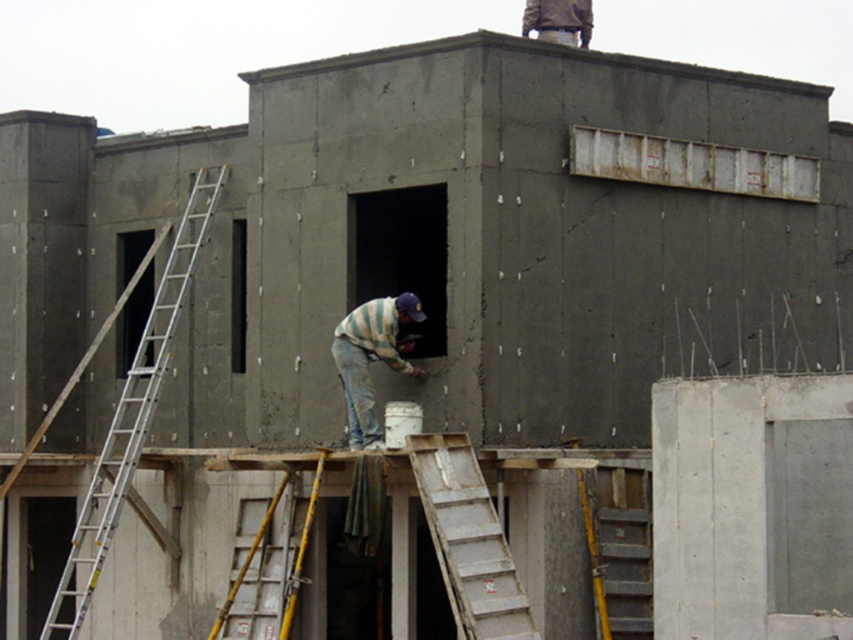
Between point (178, 280) and point (496, 621), which one is positioned behind?

Point (178, 280)

Find the location of `silver metallic ladder at left`. silver metallic ladder at left is located at coordinates (131, 417).

Is point (486, 561) behind point (352, 369)?

That is False.

Which is behind, point (457, 488) or point (350, 369)?

The point (350, 369) is more distant.

This screenshot has height=640, width=853. I want to click on wooden step ladder at center, so click(x=468, y=540).

You are a GUI agent. You are given a task and a screenshot of the screen. Output one action in this format:
    pyautogui.click(x=<x>, y=<y>)
    Task: Click on the wooden step ladder at center
    The width and height of the screenshot is (853, 640).
    Given the screenshot: What is the action you would take?
    pyautogui.click(x=468, y=540)

Is silver metallic ladder at left above yellow/yellowish metal ladder at center?

Correct, silver metallic ladder at left is located above yellow/yellowish metal ladder at center.

Does point (218, 184) lie in front of point (216, 627)?

No, it is not.

You are a GUI agent. You are given a task and a screenshot of the screen. Output one action in this format:
    pyautogui.click(x=<x>, y=<y>)
    Task: Click on the silver metallic ladder at left
    Image resolution: width=853 pixels, height=640 pixels.
    Given the screenshot: What is the action you would take?
    pyautogui.click(x=131, y=417)